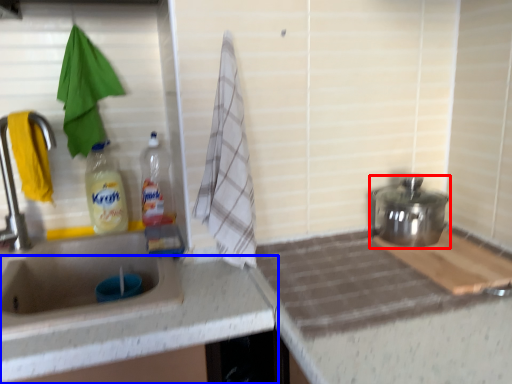
Question: Which object appears closest to the camera in this image, appliance (highlighted by a red box) or countertop (highlighted by a blue box)?

Choices:
 (A) appliance
 (B) countertop

Answer: (B)